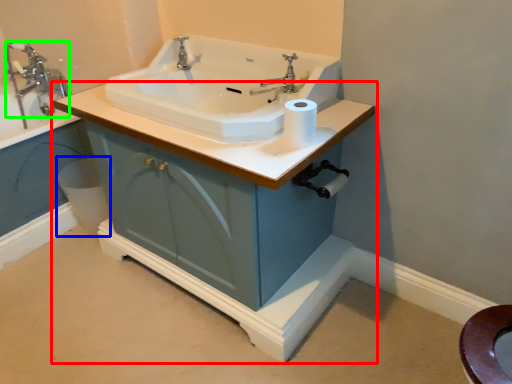
Question: Estimate the real-world distances between objects in this image. Which object is farther from bathroom cabinet (highlighted by a red box), bidet (highlighted by a blue box) or tap (highlighted by a green box)?

Choices:
 (A) bidet
 (B) tap

Answer: (B)